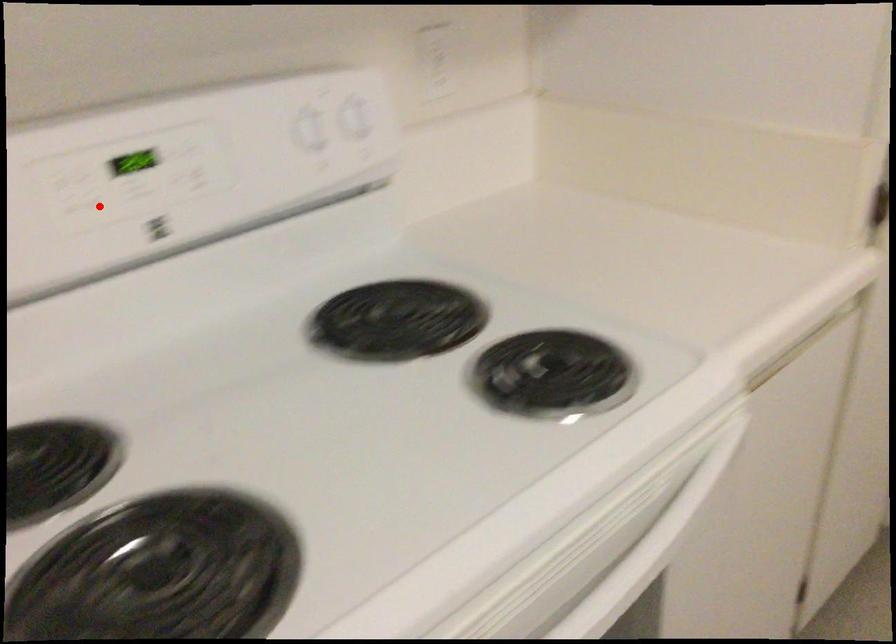
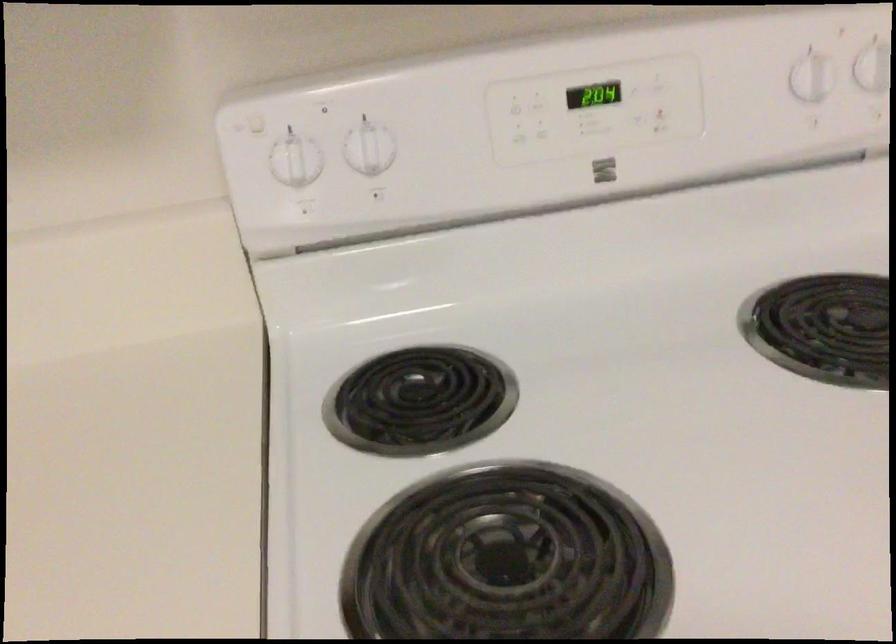
Find the pixel in the second image that matches the highlighted location in the first image.

(543, 129)